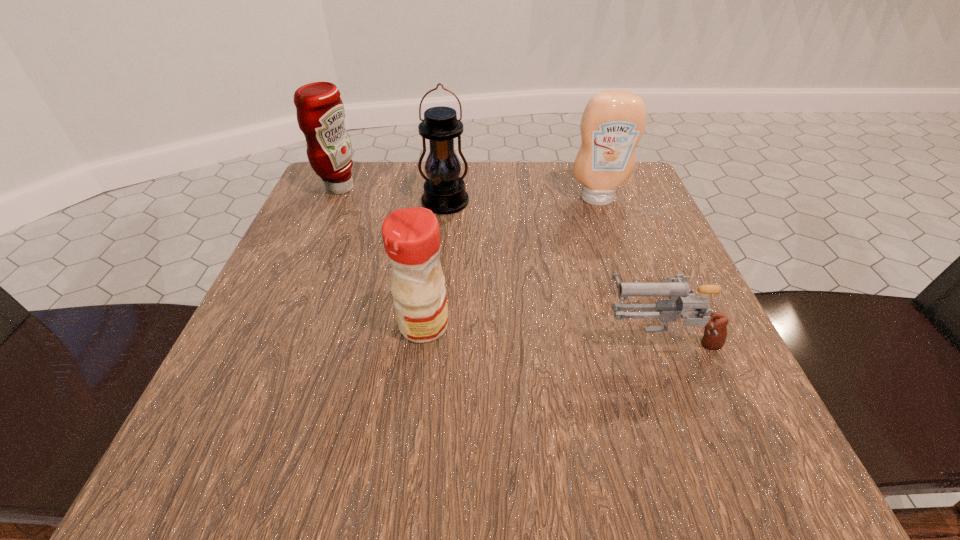
Image resolution: width=960 pixels, height=540 pixels. Identify the location of vacant point located 0.310m at the barrel end of the gun. (403, 337).

Identify the location of vacant space located at the barrel end of the gun. (396, 337).

Locate an element on the screen. Image resolution: width=960 pixels, height=540 pixels. lantern situated at the far edge is located at coordinates (444, 191).

At what (x,y) coordinates should I click in order to perform the action: click on object located at the left edge. Please return your answer as a coordinate pair (x, y). The height and width of the screenshot is (540, 960). Looking at the image, I should click on (320, 112).

This screenshot has height=540, width=960. What are the coordinates of `condiment that is at the right edge` in the screenshot? It's located at (613, 122).

At what (x,y) coordinates should I click in order to perform the action: click on gun at the right edge. Please return your answer as a coordinate pair (x, y). Looking at the image, I should click on (677, 289).

Locate an element on the screen. The height and width of the screenshot is (540, 960). object located at the far left corner is located at coordinates (320, 112).

Locate an element on the screen. The image size is (960, 540). object that is positioned at the far right corner is located at coordinates (613, 122).

I want to click on free location at the far edge, so click(510, 201).

This screenshot has height=540, width=960. I want to click on vacant space at the near edge of the desktop, so pyautogui.click(x=586, y=452).